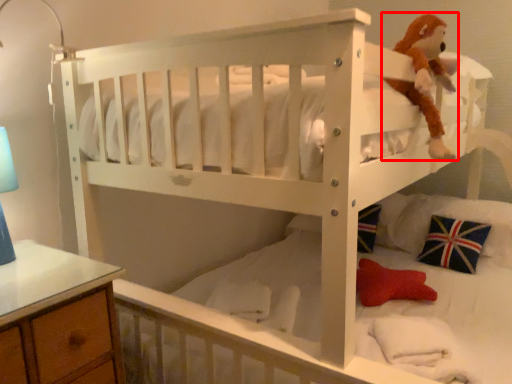
Question: From the image's perspective, what is the correct spatial relationship of toy (annotated by the red box) in relation to pillow?

Choices:
 (A) above
 (B) below

Answer: (A)